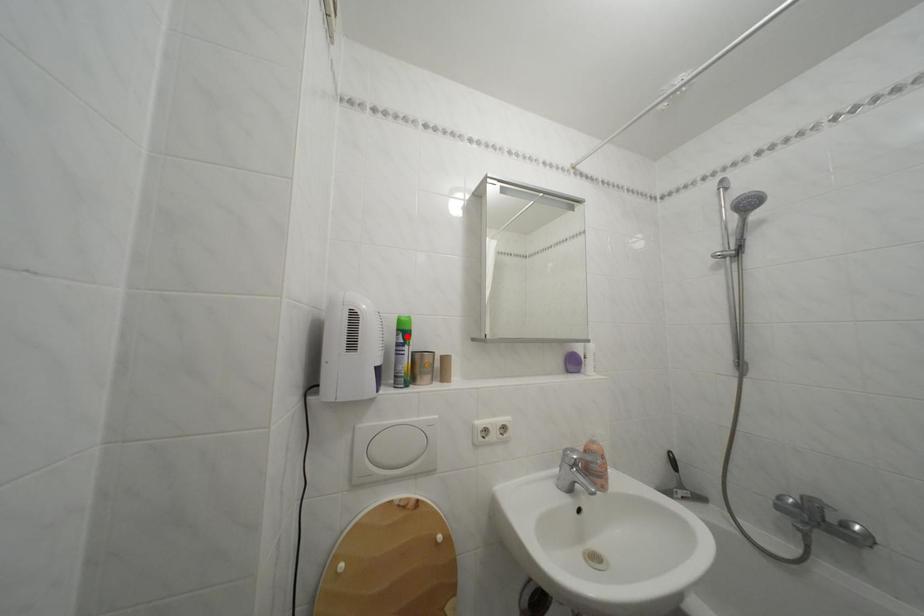
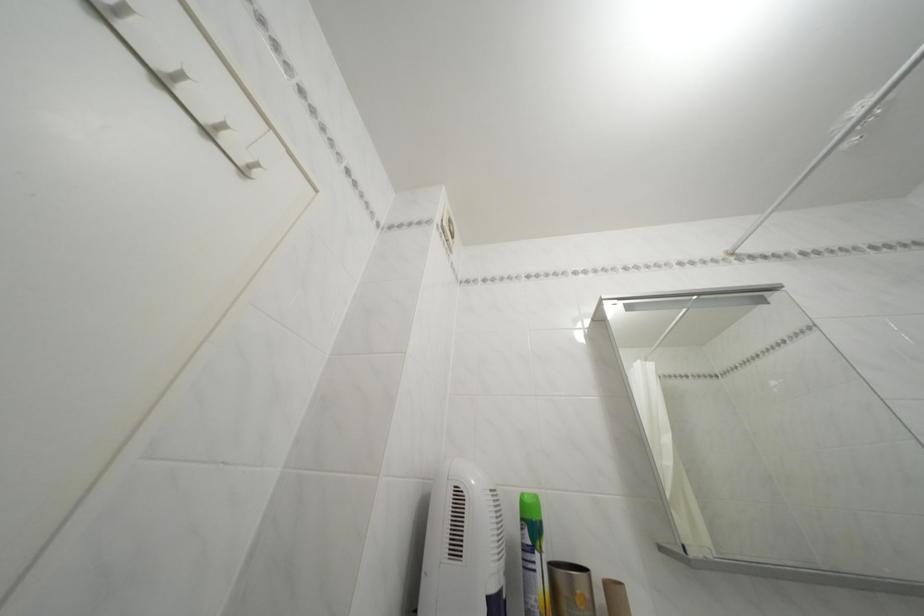
Find the pixel in the second image that matches the highlighted location in the first image.

(531, 525)